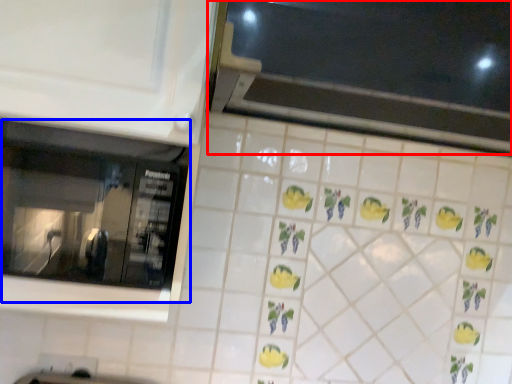
Question: Which of the following is the closest to the observer, window (highlighted by a red box) or window (highlighted by a blue box)?

Choices:
 (A) window
 (B) window

Answer: (A)